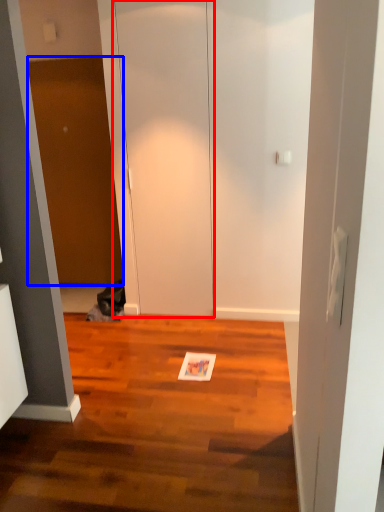
Question: Which object appears closest to the camera in this image, glass door (highlighted by a red box) or door (highlighted by a blue box)?

Choices:
 (A) glass door
 (B) door

Answer: (A)